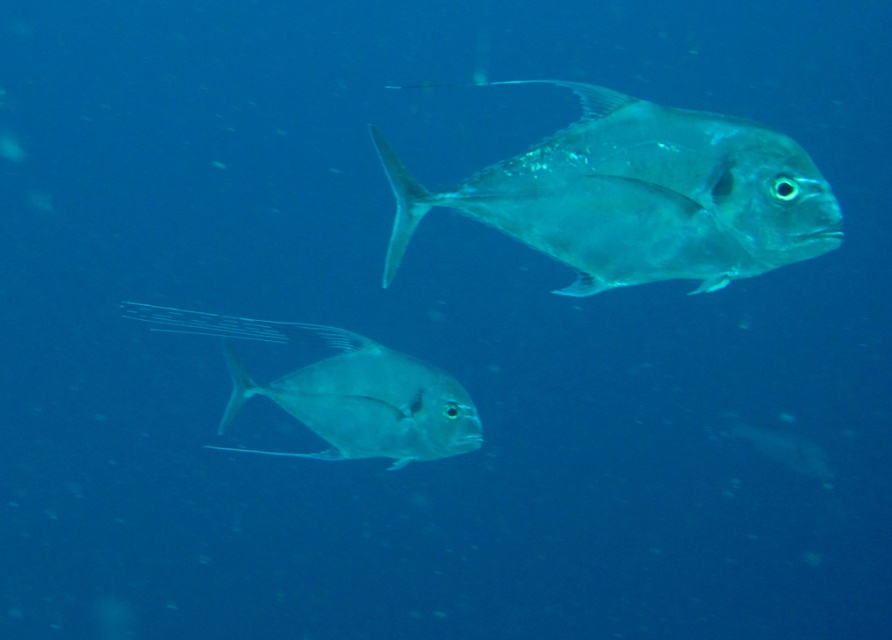
Question: Is translucent silver fish at upper right wider than translucent silver fish at center?

Choices:
 (A) yes
 (B) no

Answer: (A)

Question: Does translucent silver fish at upper right appear over translucent silver fish at center?

Choices:
 (A) no
 (B) yes

Answer: (B)

Question: Does translucent silver fish at upper right have a lesser width compared to translucent silver fish at center?

Choices:
 (A) yes
 (B) no

Answer: (B)

Question: Which point appears farthest from the camera in this image?

Choices:
 (A) (229, 369)
 (B) (395, 216)

Answer: (A)